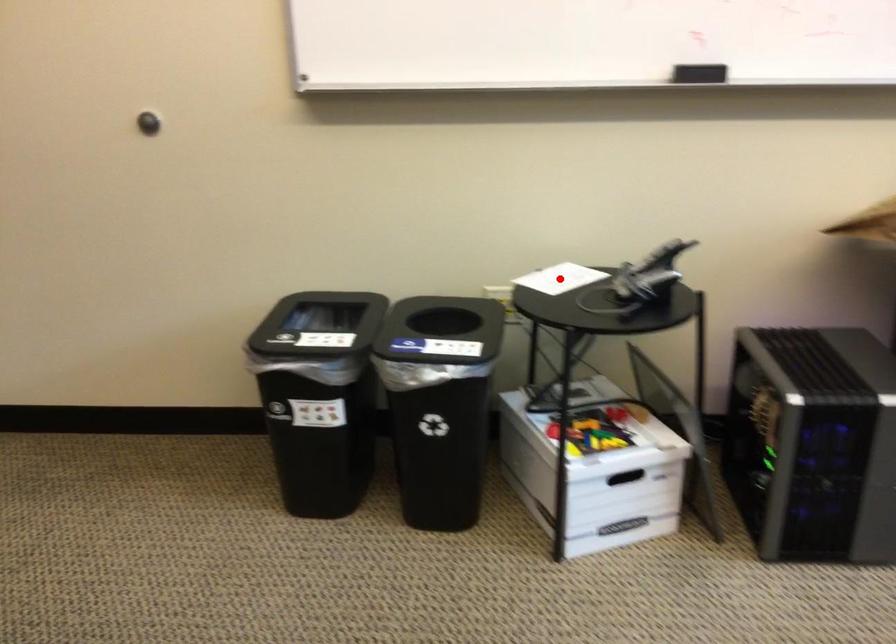
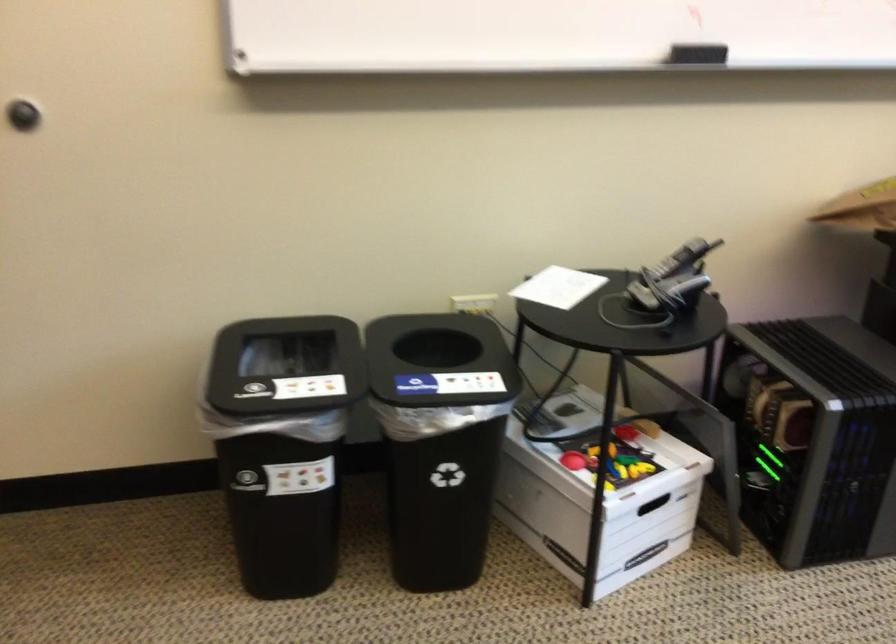
Question: I am providing you with two images of the same scene from different viewpoints. In image1, a red point is highlighted. Considering the same 3D point in image2, which of the following is correct?

Choices:
 (A) It is closer
 (B) It is farther

Answer: (A)